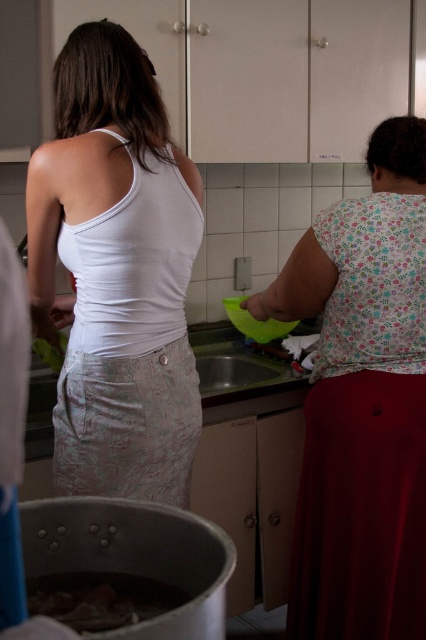
Identify the location of white lace tank top at center. This screenshot has height=640, width=426. (115, 273).

Is point (141, 358) farther from camera compared to point (282, 369)?

No, (141, 358) is closer to viewer.

The width and height of the screenshot is (426, 640). Find the location of `white lace tank top at center`. white lace tank top at center is located at coordinates (115, 273).

Where is `white lace tank top at center`? white lace tank top at center is located at coordinates tap(115, 273).

Is point (109, 250) farther from camera compared to point (354, 216)?

No, it is not.

Between point (129, 237) and point (333, 577), which one is positioned in front?

Point (129, 237)

Locate an element on the screen. This screenshot has height=640, width=426. white lace tank top at center is located at coordinates [115, 273].

Is point (28, 609) farther from camera compared to point (245, 378)?

No, it is not.

Can you confirm if dark brown meat at lower left is smaller than satin silver sink at center?

Correct, dark brown meat at lower left occupies less space than satin silver sink at center.

Where is `dark brown meat at lower left`? This screenshot has width=426, height=640. dark brown meat at lower left is located at coordinates (100, 600).